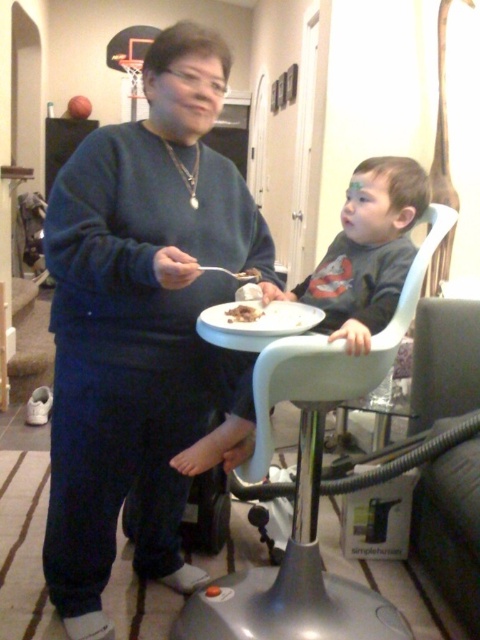
Question: Can you confirm if matte black high chair at center is wider than white matte plate at center?

Choices:
 (A) yes
 (B) no

Answer: (A)

Question: Which of these objects is positioned farthest from the dark gray matte shirt at center?

Choices:
 (A) matte black high chair at center
 (B) chocolate cake at center

Answer: (A)

Question: Can you confirm if dark gray matte shirt at center is positioned to the right of white matte plate at center?

Choices:
 (A) yes
 (B) no

Answer: (A)

Question: Does matte black high chair at center have a lesser width compared to chocolate cake at center?

Choices:
 (A) no
 (B) yes

Answer: (A)

Question: Which point appears closest to the camera in this image?

Choices:
 (A) (432, 326)
 (B) (235, 321)

Answer: (B)

Question: Which point is closer to the camera?

Choices:
 (A) dark gray matte shirt at center
 (B) matte black high chair at center
 (C) white matte plate at center

Answer: (C)